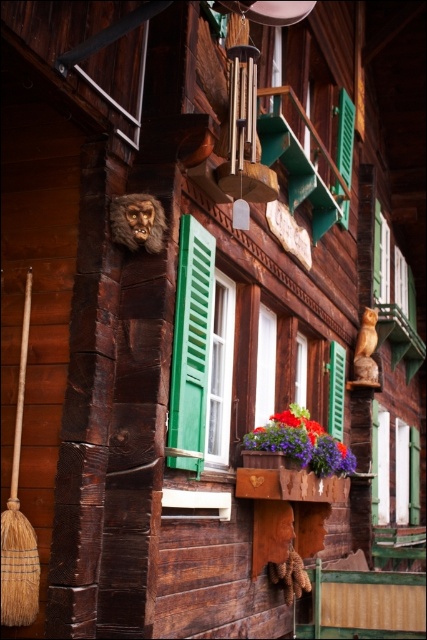
You are a painter standing 10 feet away from the wooden building. You want to paint both the green matte shutter at center and the wooden flower box at center in one painting without moving. Can you fit both in your canvas if your canvas is 6 feet wide?

The distance between the green matte shutter at center and wooden flower box at center is 5.20 feet. Since your canvas is 6 feet wide, which is wider than the 5.20 feet separating them, you can fit both in your canvas without moving.

You are standing at the entrance of the wooden building and see a point marked at coordinates (x=301, y=442). What color petals are located at that specific point?

The point at (x=301, y=442) has vivid purple petals at center.